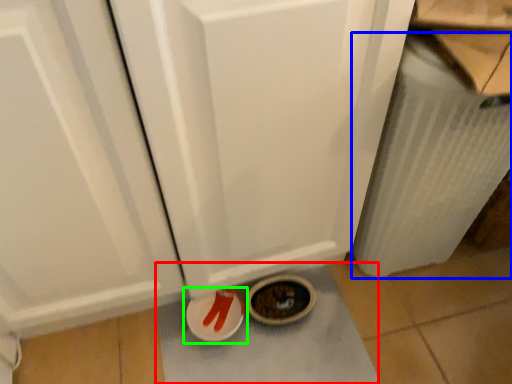
Question: Which is farther away from bath mat (highlighted by a red box)? radiator (highlighted by a blue box) or footwear (highlighted by a green box)?

Choices:
 (A) radiator
 (B) footwear

Answer: (A)